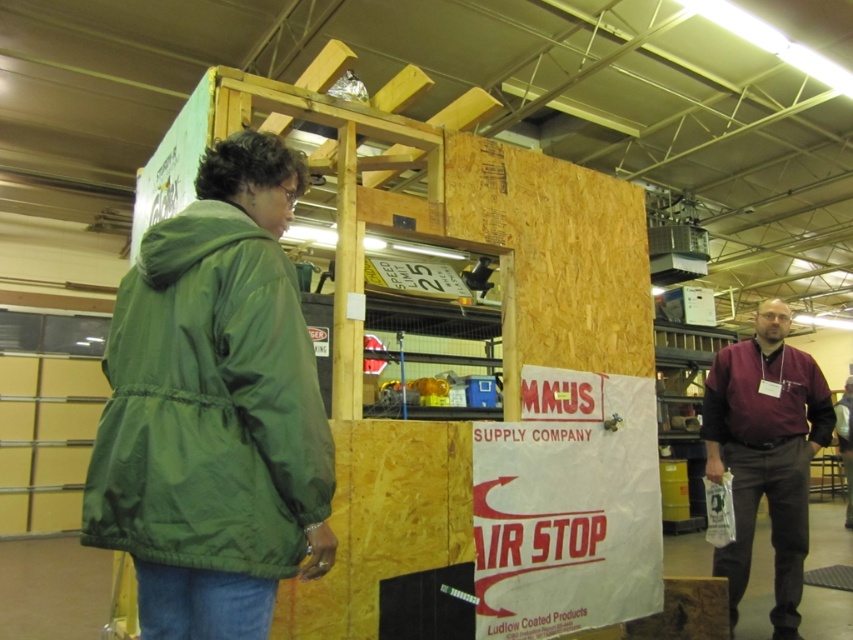
You are organizing items in the workshop and need to place a new tool box between the green nylon jacket at left and the white paper sign at center. Can you fit it there?

The green nylon jacket at left is to the left of the white paper sign at center, so there is space between them. You can fit the tool box there.

You are an employee in the workshop and need to retrieve a tool from the shelf behind the green nylon jacket at left and the maroon fabric shirt at right. Which item should you move first to access the shelf?

You should move the green nylon jacket at left first because it is positioned over the maroon fabric shirt at right, meaning it is closer to you and blocking access to the shelf.

From the picture: You are an observer in the workshop scene. You notice a green nylon jacket at left and a maroon fabric shirt at right. Which of these two items is shorter in height?

The green nylon jacket at left is not as tall as the maroon fabric shirt at right, so the green nylon jacket at left is shorter in height.